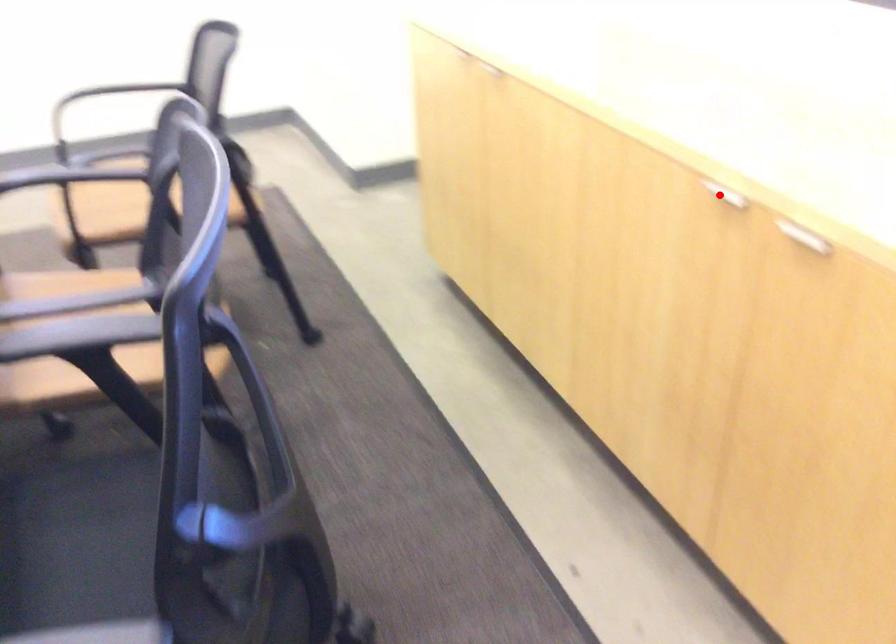
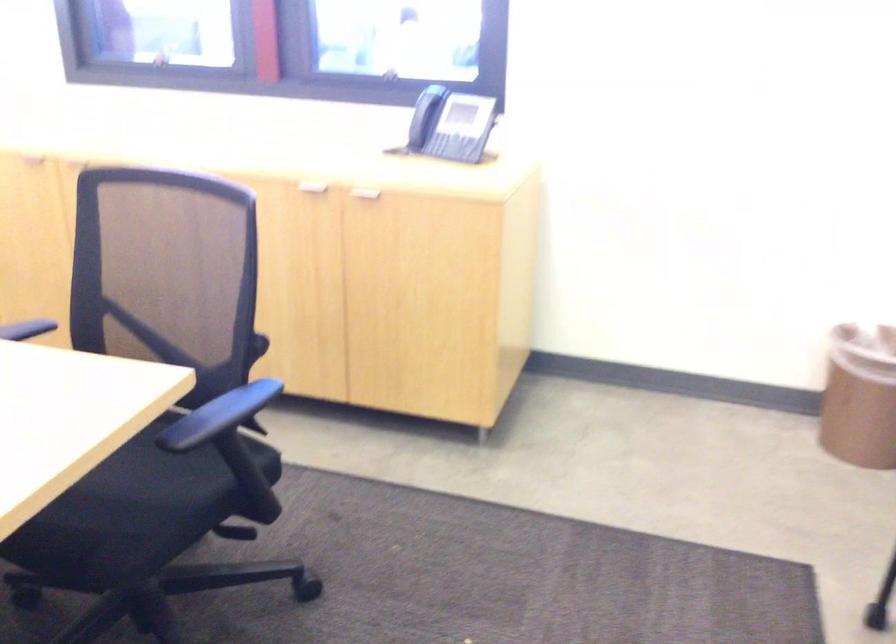
The point at the highlighted location is marked in the first image. Where is the corresponding point in the second image?

(305, 187)